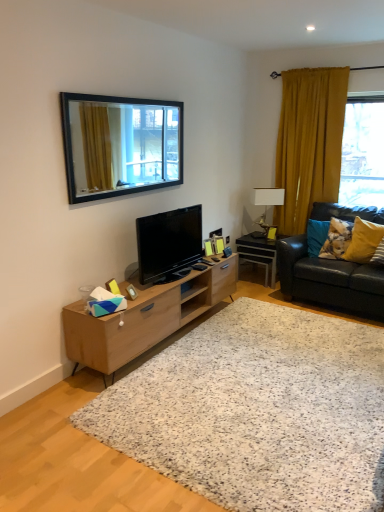
Find the location of `free space above mustard velvet curtain at right (from a real-world perspective)`. free space above mustard velvet curtain at right (from a real-world perspective) is located at coordinates (324, 63).